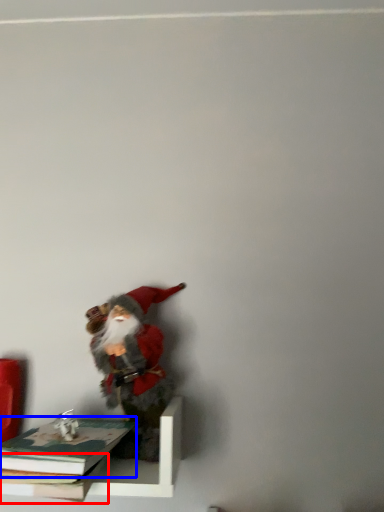
Question: Which point is closer to the camera, book (highlighted by a red box) or book (highlighted by a blue box)?

Choices:
 (A) book
 (B) book

Answer: (B)